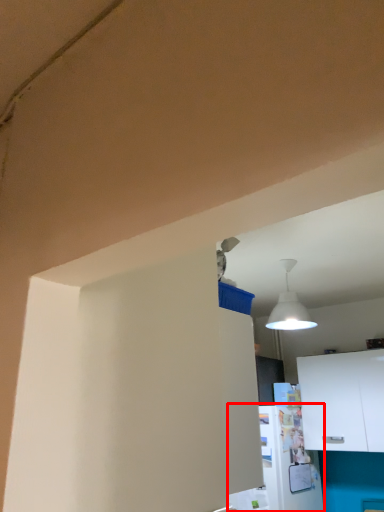
Question: From the image's perspective, what is the correct spatial relationship of appliance (annotated by the red box) in relation to cabinetry?

Choices:
 (A) below
 (B) above

Answer: (A)